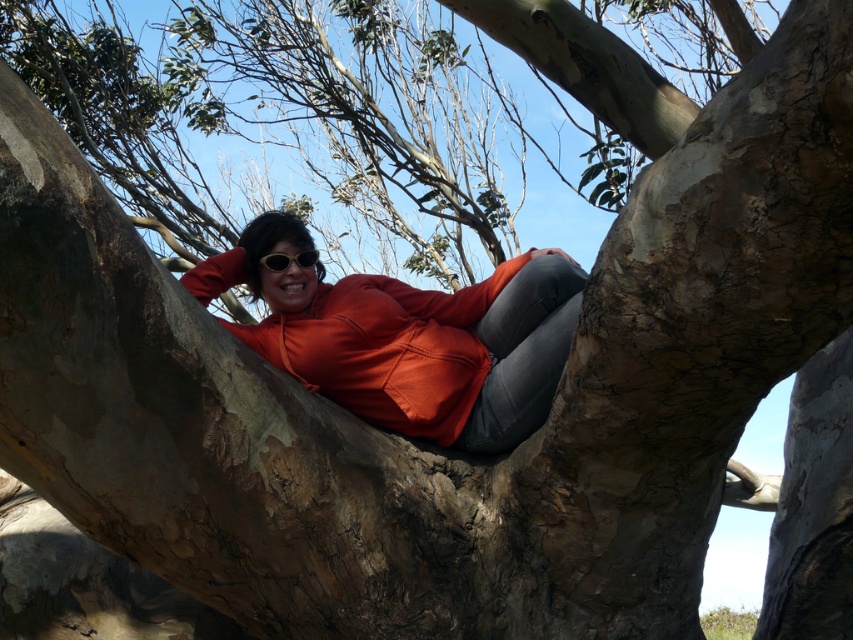
Question: Can you confirm if matte orange sweatshirt at center is smaller than sunglasses at center?

Choices:
 (A) no
 (B) yes

Answer: (A)

Question: Can you confirm if matte orange sweatshirt at center is bigger than sunglasses at center?

Choices:
 (A) no
 (B) yes

Answer: (B)

Question: Which point is farther to the camera?

Choices:
 (A) (386, 330)
 (B) (309, 257)

Answer: (B)

Question: Which object is farther from the camera taking this photo?

Choices:
 (A) sunglasses at center
 (B) matte orange sweatshirt at center

Answer: (A)

Question: Does matte orange sweatshirt at center have a lesser width compared to sunglasses at center?

Choices:
 (A) no
 (B) yes

Answer: (A)

Question: Which of the following is the farthest from the observer?

Choices:
 (A) matte orange sweatshirt at center
 (B) sunglasses at center

Answer: (B)